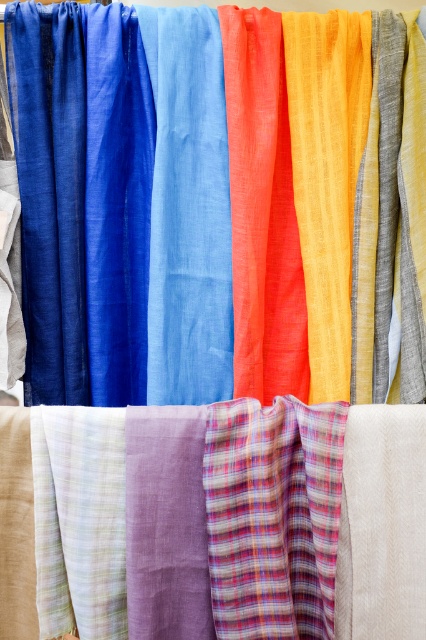
You are a customer looking at the fabric display. There are two fabrics you are considering, the plaid fabric at center and the matte blue fabric at center. Which one is located above the other?

The plaid fabric at center is positioned under the matte blue fabric at center, so the matte blue fabric at center is above the plaid fabric at center.

You are a tailor trying to create a dress that requires a fabric with a specific width. You have two options in the image, the plaid fabric at center and the matte blue fabric at center. Which fabric has a narrower width?

The plaid fabric at center has a lesser width compared to the matte blue fabric at center, so the plaid fabric at center is narrower.